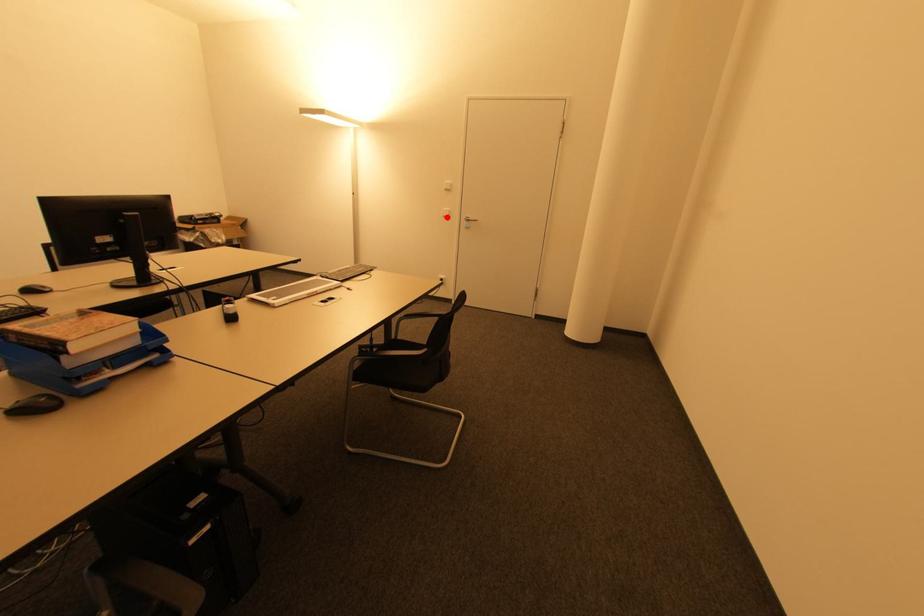
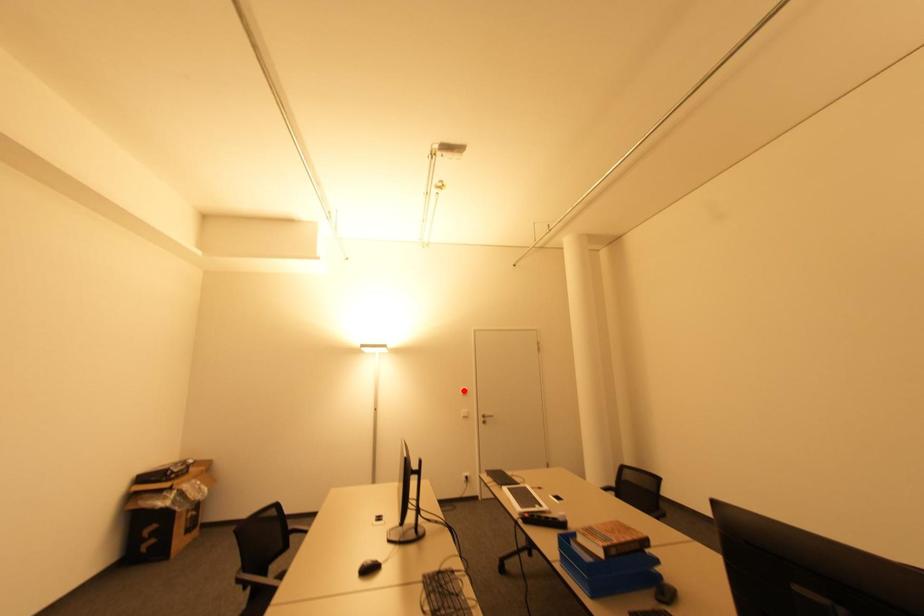
I am providing you with two images of the same scene from different viewpoints. A red point is marked on the first image and another point is marked on the second image. Is the red point in image1 aligned with the point shown in image2?

No